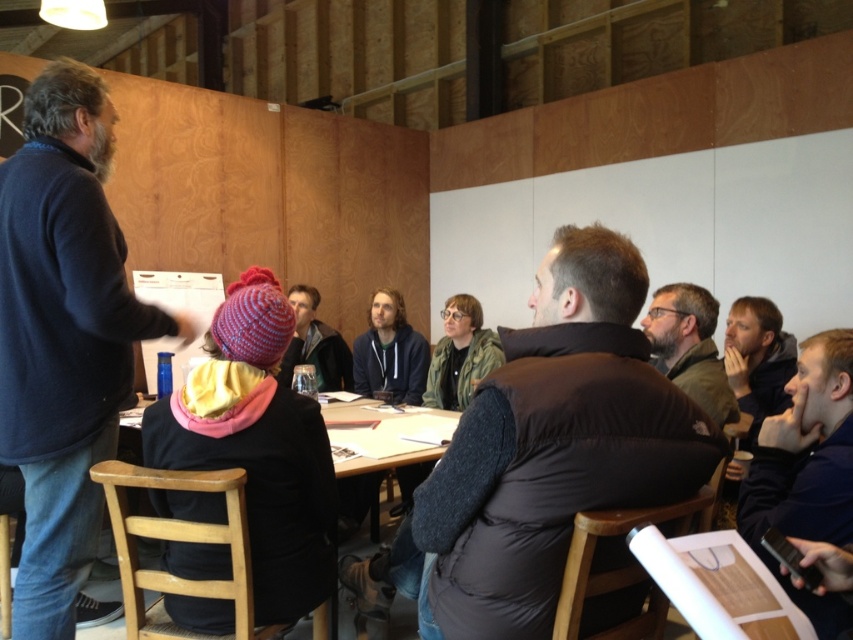
Question: Considering the real-world distances, which object is closest to the knitted wool hat at center?

Choices:
 (A) dark brown puffer vest at center
 (B) dark gray hoodie at center
 (C) dark blue sweater at left

Answer: (C)

Question: Does wooden table at center have a greater width compared to dark blue puffer jacket at lower right?

Choices:
 (A) no
 (B) yes

Answer: (B)

Question: Is dark blue hoodie at center above knitted wool hat at center?

Choices:
 (A) yes
 (B) no

Answer: (B)

Question: Considering the real-world distances, which object is farthest from the dark blue hoodie at center?

Choices:
 (A) wooden table at center
 (B) matte black jacket at center

Answer: (A)

Question: Is dark brown puffer vest at center wider than dark blue hoodie at center?

Choices:
 (A) no
 (B) yes

Answer: (B)

Question: Estimate the real-world distances between objects in this image. Which object is farther from the dark blue puffer jacket at lower right?

Choices:
 (A) knitted wool hat at center
 (B) dark blue hoodie at center
 (C) wooden table at center

Answer: (A)